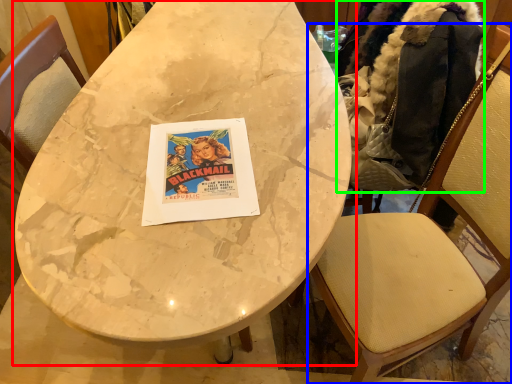
Question: Based on their relative distances, which object is farther from table (highlighted by a red box)? Choose from chair (highlighted by a blue box) and jacket (highlighted by a green box).

Choices:
 (A) chair
 (B) jacket

Answer: (A)